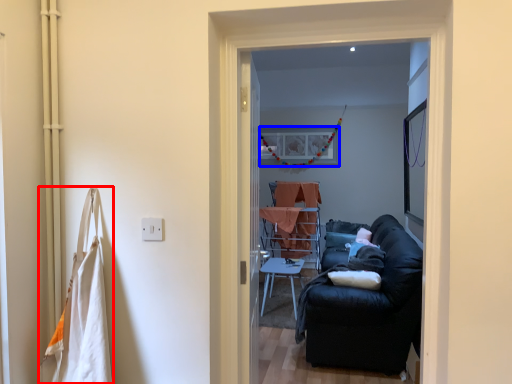
Question: Which object is closer to the camera taking this photo, laundry (highlighted by a red box) or picture frame (highlighted by a blue box)?

Choices:
 (A) laundry
 (B) picture frame

Answer: (A)